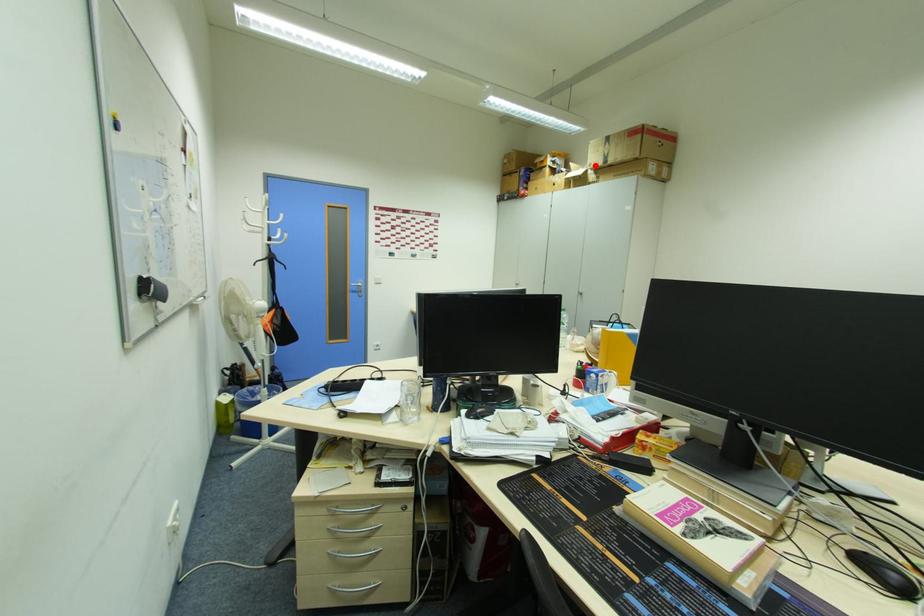
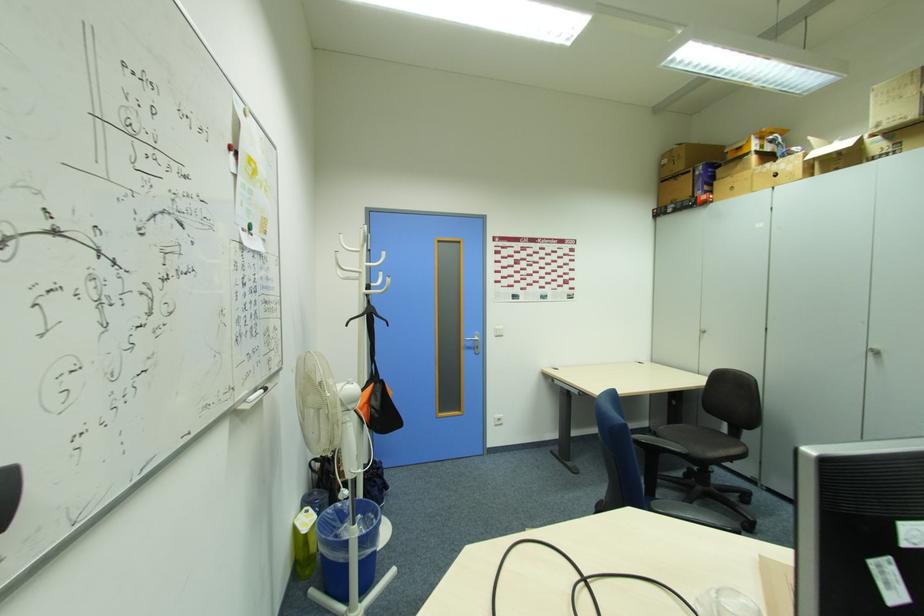
Question: A red point is marked in image1. In image2, is the corresponding 3D point closer to the camera or farther? Reply with the corresponding letter.

Choices:
 (A) The corresponding 3D point is closer.
 (B) The corresponding 3D point is farther.

Answer: (B)